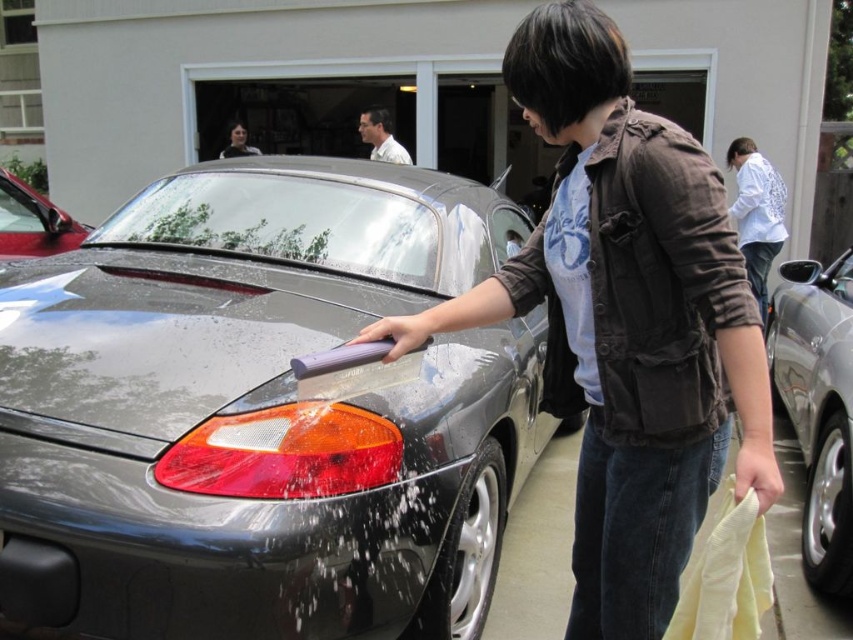
Image resolution: width=853 pixels, height=640 pixels. I want to click on glossy metallic car at center, so click(x=260, y=412).

Can you confirm if glossy metallic car at center is positioned to the right of glossy metallic car at upper left?

Yes, glossy metallic car at center is to the right of glossy metallic car at upper left.

I want to click on glossy metallic car at center, so click(x=260, y=412).

This screenshot has height=640, width=853. In order to click on glossy metallic car at center in this screenshot , I will do point(260,412).

How distant is white textured shirt at upper right from glossy metallic car at upper left?

The distance of white textured shirt at upper right from glossy metallic car at upper left is 6.20 meters.

Does white textured shirt at upper right have a lesser width compared to glossy metallic car at upper left?

Indeed, white textured shirt at upper right has a lesser width compared to glossy metallic car at upper left.

This screenshot has width=853, height=640. Identify the location of white textured shirt at upper right. (757, 212).

Does glossy metallic car at center appear over satin silver car at right?

Yes.

Based on the photo, who is more forward, (352, 512) or (791, 292)?

Positioned in front is point (352, 512).

Does point (360, 513) come in front of point (811, 563)?

That is True.

This screenshot has width=853, height=640. In order to click on glossy metallic car at center in this screenshot , I will do `click(260, 412)`.